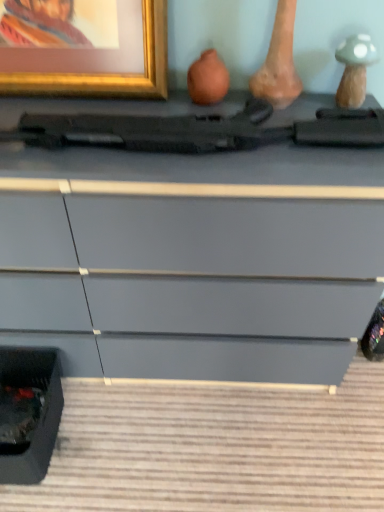
At what (x,y) coordinates should I click in order to perform the action: click on free space above matte gray chest of drawers at center (from a real-world perspective). Please return your answer as a coordinate pair (x, y). The image size is (384, 512). Looking at the image, I should click on (147, 112).